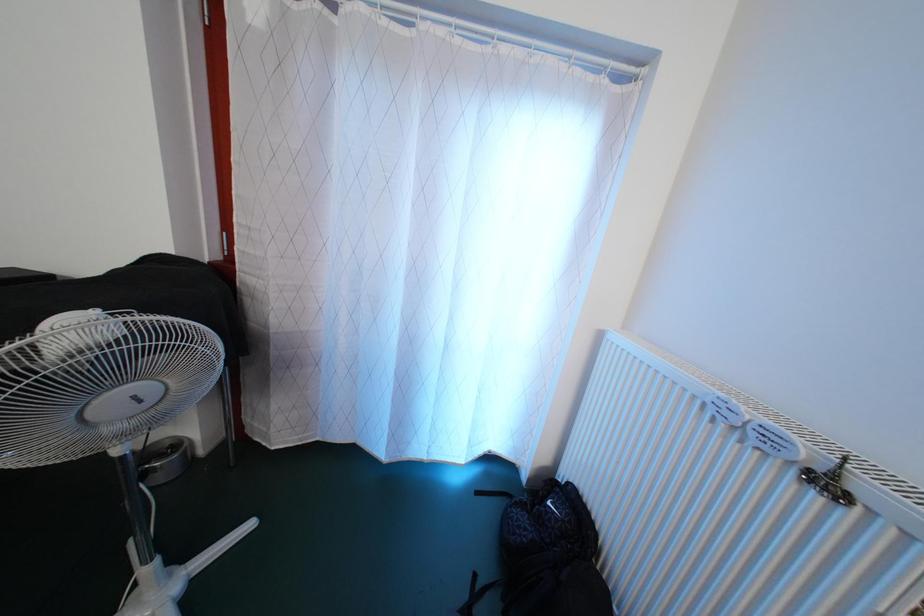
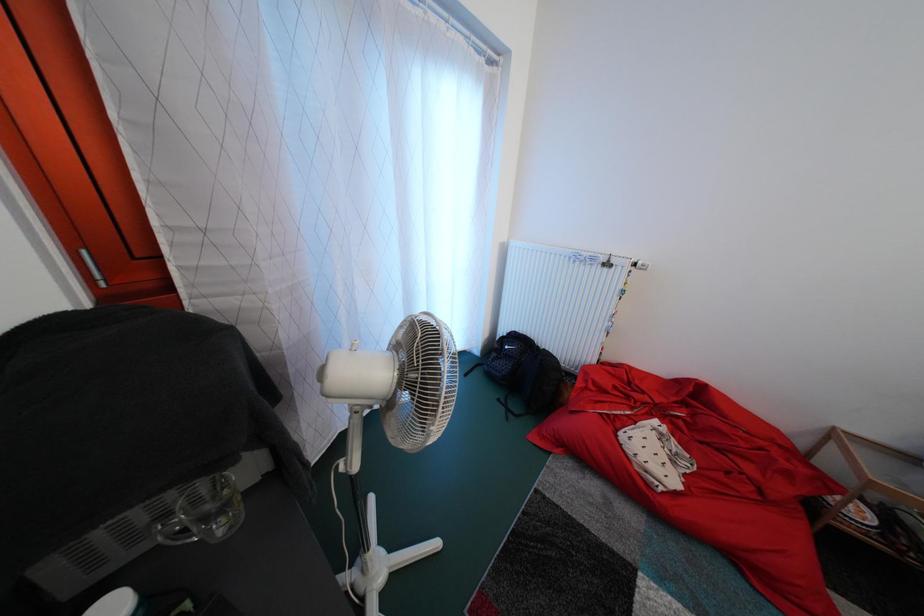
The first image is from the beginning of the video and the second image is from the end. How did the camera likely rotate when shooting the video?

The rotation direction of the camera is right-down.